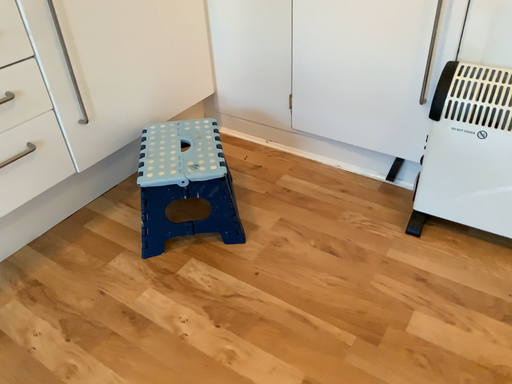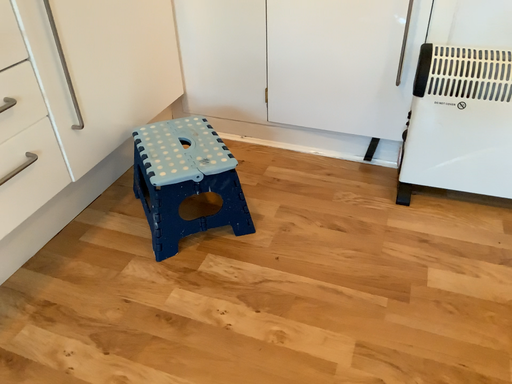
Question: How did the camera likely rotate when shooting the video?

Choices:
 (A) rotated left
 (B) rotated right

Answer: (B)